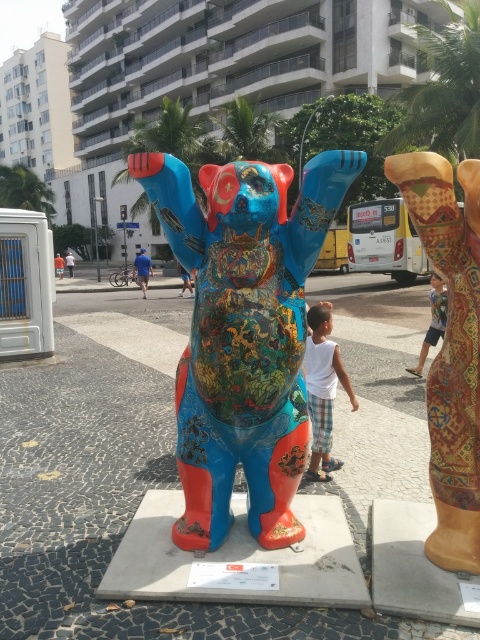
You are standing in front of the vibrant public art installation and notice two items in the scene. The first is a textured fabric leg at right, and the second is a white cotton shirt at center. Based on their positions, which one is located to the right of the other?

The textured fabric leg at right is located to the right of the white cotton shirt at center.

You are a fashion designer observing the public art installation. You notice a white cotton shirt at center and light blue denim shorts at lower right. Which clothing item appears taller in the scene?

The white cotton shirt at center is taller than the light blue denim shorts at lower right.